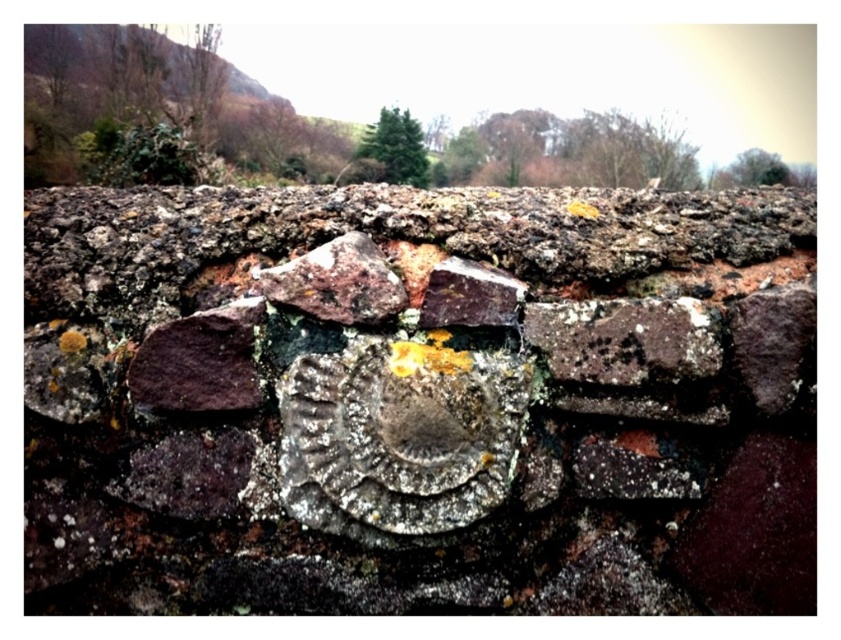
Question: Is rusty stone plaque at center to the left of purple stone at left from the viewer's perspective?

Choices:
 (A) no
 (B) yes

Answer: (A)

Question: Is rusty stone plaque at center smaller than purple stone at left?

Choices:
 (A) yes
 (B) no

Answer: (B)

Question: Is rusty stone plaque at center wider than purple stone at left?

Choices:
 (A) yes
 (B) no

Answer: (A)

Question: Which point appears farthest from the camera in this image?

Choices:
 (A) (234, 384)
 (B) (414, 488)

Answer: (A)

Question: Among these objects, which one is farthest from the camera?

Choices:
 (A) purple stone at left
 (B) rusty stone plaque at center

Answer: (A)

Question: Which point is farther to the camera?

Choices:
 (A) (214, 328)
 (B) (701, 292)

Answer: (B)